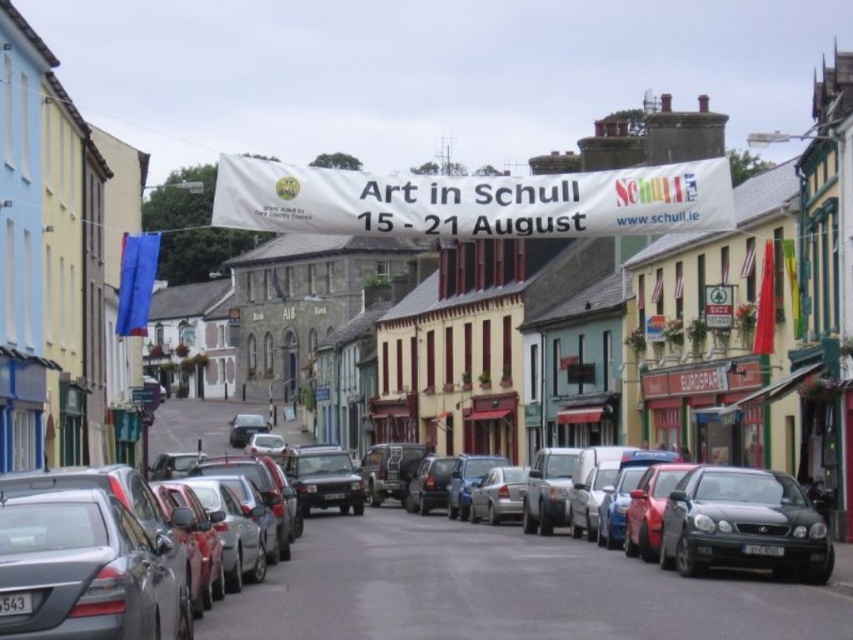
You are a photographer positioned on the street during the Art in Schull festival. You notice two shiny black sedans parked in the scene. Which sedan is closer to the photographer, the shiny black sedan at center or the shiny black sedan at right?

The shiny black sedan at center is closer to the photographer because it is positioned below the shiny black sedan at right, indicating it is in a lower, more forward position in the image.

You are standing at the corner of the street and want to locate the shiny black sedan at center. According to the coordinates provided, where exactly should you look?

The shiny black sedan at center is located at point (502, 589).

You are a delivery person trying to park your van between the shiny black sedan at center and the shiny black sedan at right. The van is 2.2 meters wide. Can you fit your van between them?

The shiny black sedan at center might be wider than shiny black sedan at right, so it is uncertain if the space between them is sufficient for a 2.2 meter wide van. Check the actual width before attempting to park.